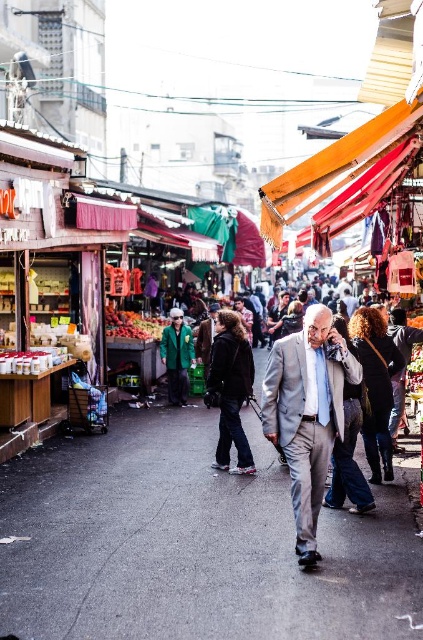
Between gray asphalt alley at center and green fabric jacket at center, which one is positioned higher?

Positioned higher is green fabric jacket at center.

Does point (192, 476) lie in front of point (180, 392)?

Yes.

Does point (121, 536) come in front of point (175, 369)?

Yes, point (121, 536) is closer to viewer.

This screenshot has width=423, height=640. In order to click on gray asphalt alley at center in this screenshot , I will do `click(191, 545)`.

Which is below, gray suit at center or green fabric jacket at center?

gray suit at center is lower down.

The height and width of the screenshot is (640, 423). Identify the location of gray suit at center. (307, 413).

You are a GUI agent. You are given a task and a screenshot of the screen. Output one action in this format:
    pyautogui.click(x=<x>, y=<y>)
    Task: Click on the gray suit at center
    The height and width of the screenshot is (640, 423).
    Given the screenshot: What is the action you would take?
    pyautogui.click(x=307, y=413)

Is gray asphalt alley at center above gray suit at center?

Actually, gray asphalt alley at center is below gray suit at center.

Does gray asphalt alley at center have a greater height compared to gray suit at center?

No, gray asphalt alley at center is not taller than gray suit at center.

Describe the element at coordinates (191, 545) in the screenshot. This screenshot has height=640, width=423. I see `gray asphalt alley at center` at that location.

Identify the location of gray asphalt alley at center. This screenshot has height=640, width=423. (191, 545).